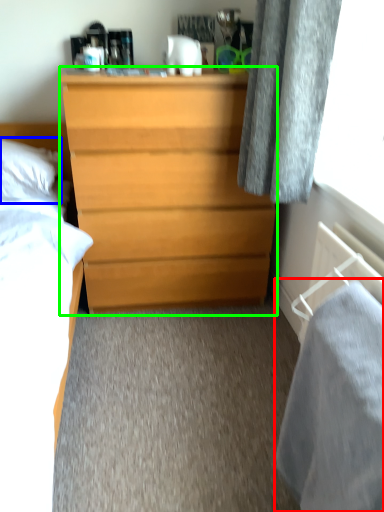
Question: Estimate the real-world distances between objects in this image. Which object is farther from sheet (highlighted by a red box), pillow (highlighted by a blue box) or chest of drawers (highlighted by a green box)?

Choices:
 (A) pillow
 (B) chest of drawers

Answer: (A)